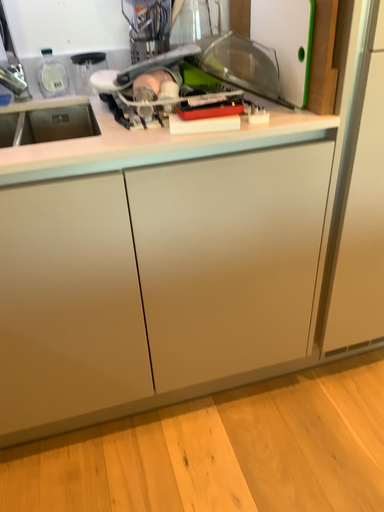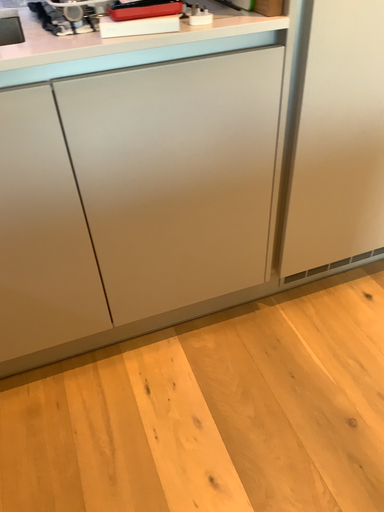
Question: Which way did the camera rotate in the video?

Choices:
 (A) rotated downward
 (B) rotated upward

Answer: (A)